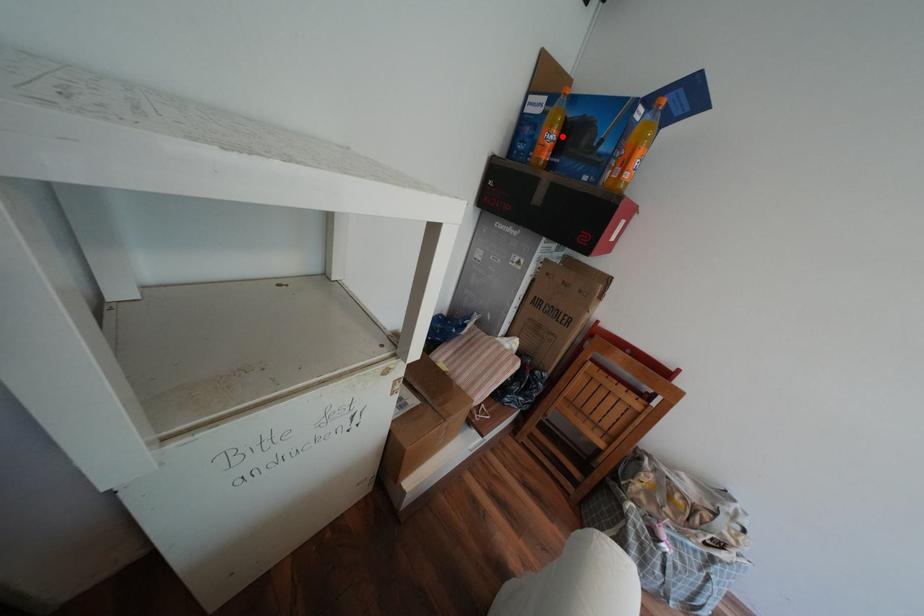
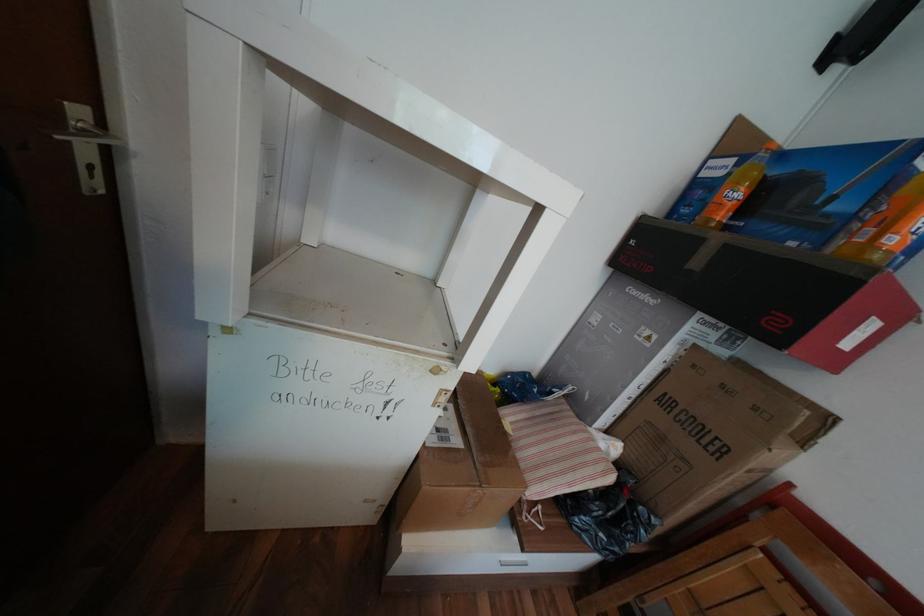
In the second image, find the point that corresponds to the highlighted location in the first image.

(748, 195)